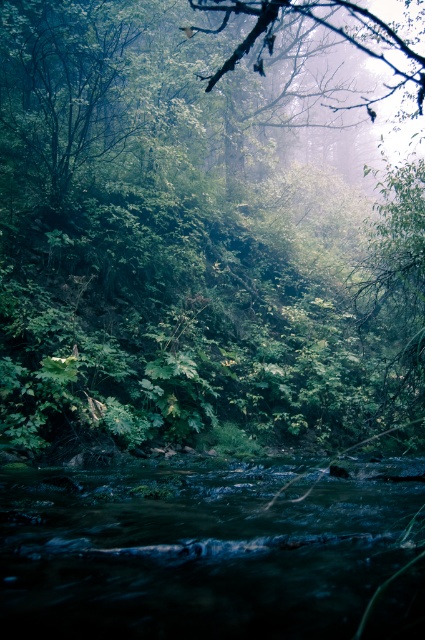
You are standing in the forest scene and want to reach the point marked at coordinates (56,154). Given that your walking speed is 3 feet per second, how many seconds will it take you to reach that point?

The point marked at coordinates (56,154) is 43.16 feet away from the camera. At a walking speed of 3 feet per second, it would take approximately 14.39 seconds to reach the point. Since we typically round to the nearest whole number, it would take about 14 seconds.

You are a hiker who wants to cross the dark green water at center. There is a green leafy tree at center nearby. Can you use the tree to help you cross the water?

The green leafy tree at center is much taller than the dark green water at center, so you can use its branches to help you cross the water safely.

You are standing in the forest and see a point marked at coordinates (172, 250). According to the scene description, what object is located at that point?

The point at coordinates (172, 250) indicates a green leafy tree at center.